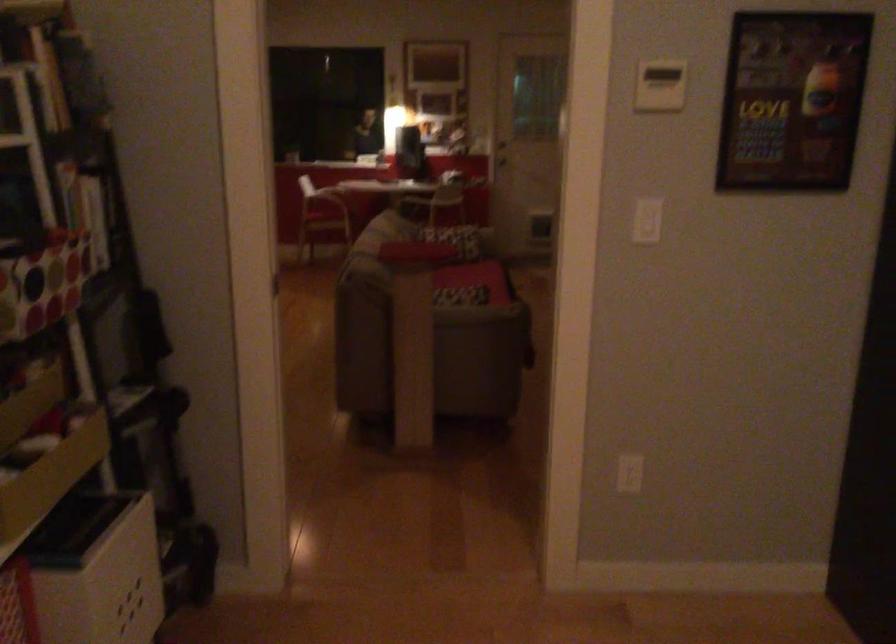
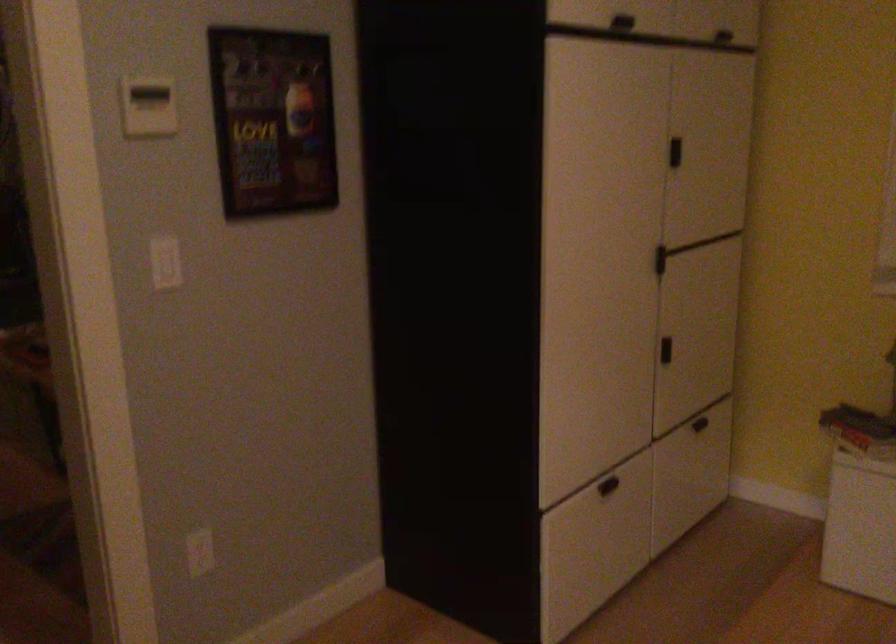
Question: The first image is from the beginning of the video and the second image is from the end. How did the camera likely rotate when shooting the video?

Choices:
 (A) Left
 (B) Right
 (C) Up
 (D) Down

Answer: (B)